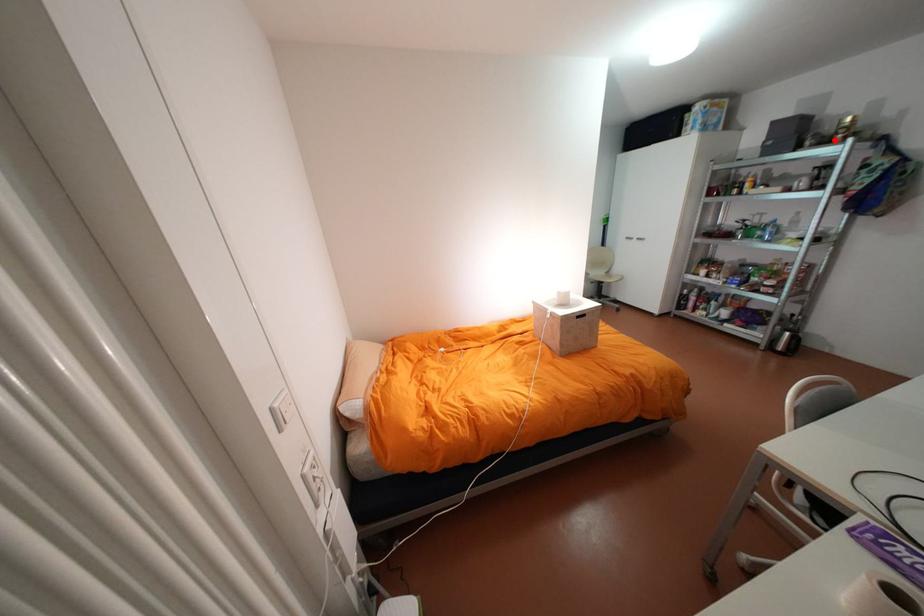
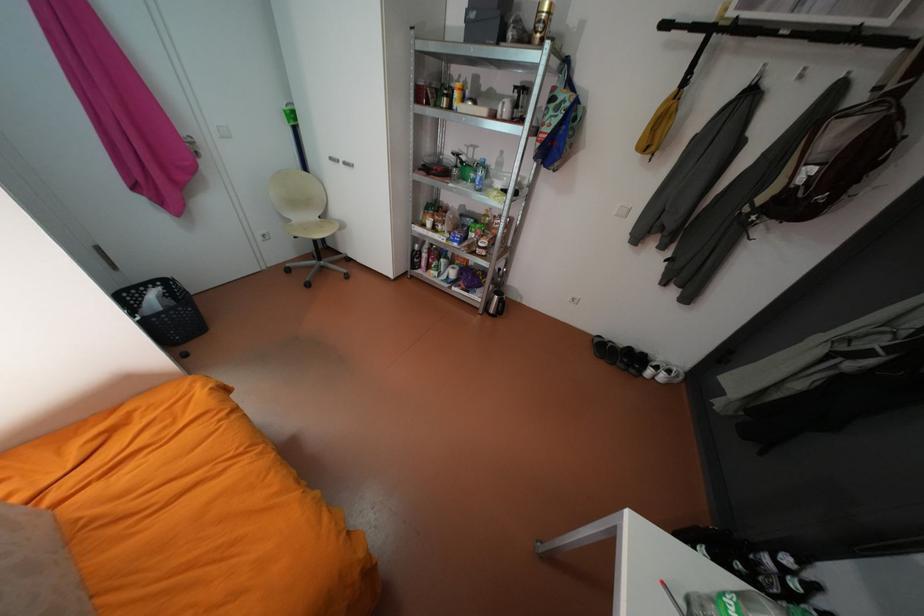
Where in the second image is the point corresponding to the highlighted location from the first image?

(533, 39)